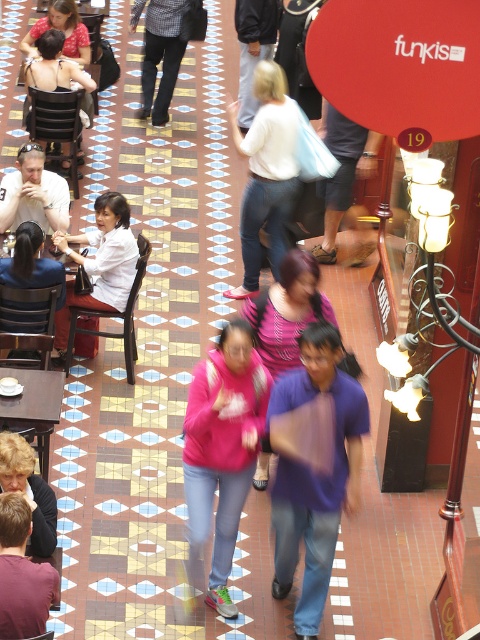
Which is below, checkered fabric pants at upper center or matte black chair at upper left?

matte black chair at upper left is below.

Which is in front, point (156, 4) or point (52, 49)?

Point (52, 49) is in front.

You are a GUI agent. You are given a task and a screenshot of the screen. Output one action in this format:
    pyautogui.click(x=<x>, y=<y>)
    Task: Click on the checkered fabric pants at upper center
    Image resolution: width=480 pixels, height=640 pixels.
    Given the screenshot: What is the action you would take?
    pyautogui.click(x=167, y=49)

Is matte white sweater at center above matte black chair at upper left?

No.

What do you see at coordinates (265, 172) in the screenshot? I see `matte white sweater at center` at bounding box center [265, 172].

The image size is (480, 640). In order to click on matte white sweater at center in this screenshot , I will do `click(265, 172)`.

This screenshot has width=480, height=640. What do you see at coordinates (222, 451) in the screenshot? I see `pink matte hoodie at center` at bounding box center [222, 451].

Does pink matte hoodie at center appear under wooden table at lower left?

Yes.

Find the location of a particular element. The image size is (480, 640). pink matte hoodie at center is located at coordinates (222, 451).